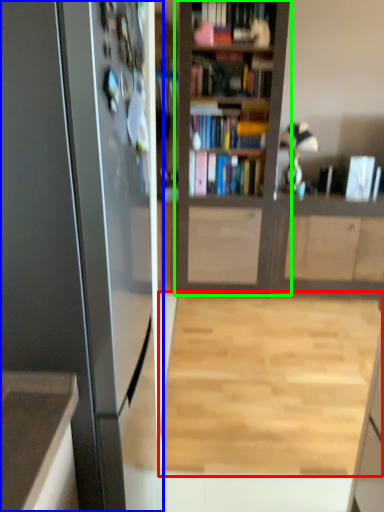
Question: Which object is the farthest from plain (highlighted by a red box)? Choose among these: appliance (highlighted by a blue box) or bookcase (highlighted by a green box).

Choices:
 (A) appliance
 (B) bookcase

Answer: (A)